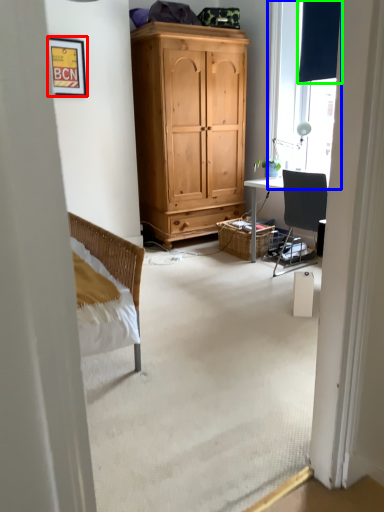
Question: Considering the real-world distances, which object is closest to picture frame (highlighted by a red box)? window (highlighted by a blue box) or curtain (highlighted by a green box).

Choices:
 (A) window
 (B) curtain

Answer: (A)